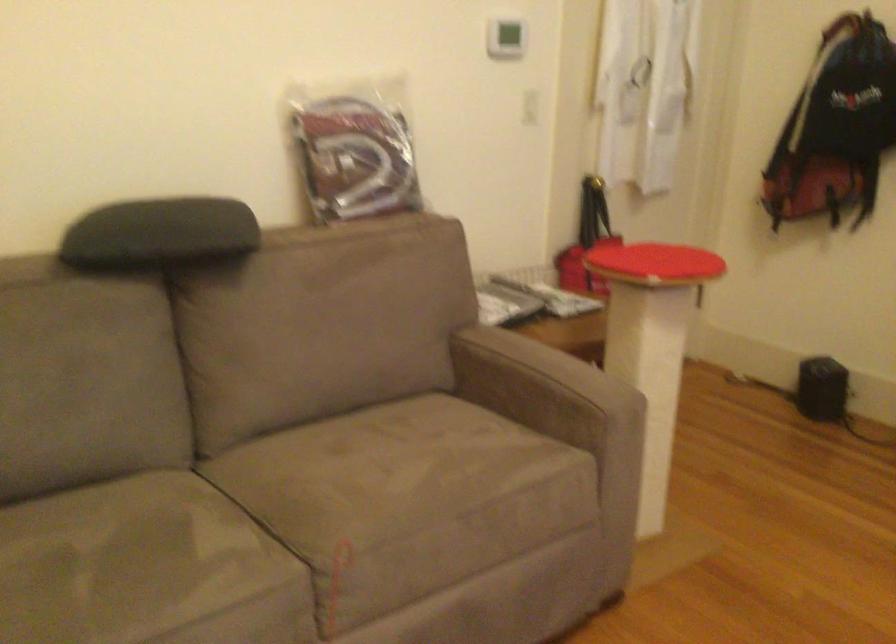
Where would you press the light switch? Please return your answer as a coordinate pair (x, y).

(505, 38)